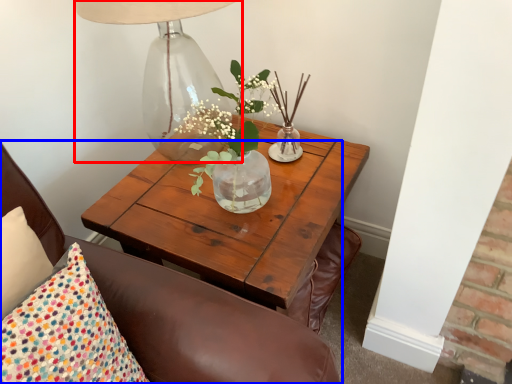
Question: Among these objects, which one is nearest to the camera, table lamp (highlighted by a red box) or chair (highlighted by a blue box)?

Choices:
 (A) table lamp
 (B) chair

Answer: (B)